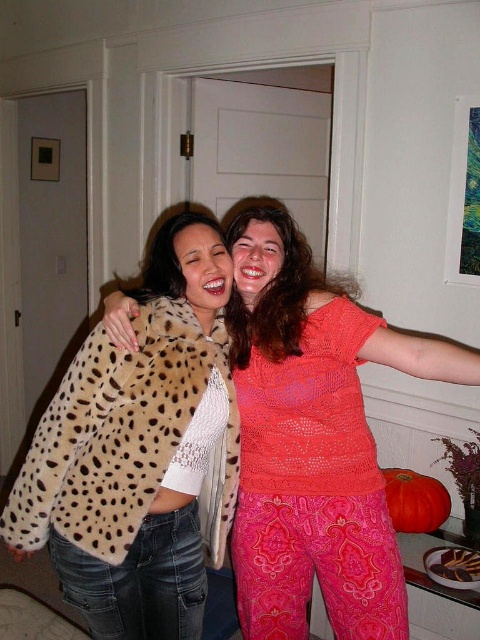
Question: Can you confirm if spotted fur coat at center is positioned to the right of cheetah print coat at center?

Choices:
 (A) yes
 (B) no

Answer: (B)

Question: Which point is closer to the camera?

Choices:
 (A) (151, 358)
 (B) (235, 557)

Answer: (A)

Question: Does spotted fur coat at center have a smaller size compared to cheetah print coat at center?

Choices:
 (A) no
 (B) yes

Answer: (B)

Question: Among these objects, which one is nearest to the camera?

Choices:
 (A) spotted fur coat at center
 (B) cheetah print coat at center

Answer: (B)

Question: Can you confirm if spotted fur coat at center is positioned below cheetah print coat at center?

Choices:
 (A) no
 (B) yes

Answer: (A)